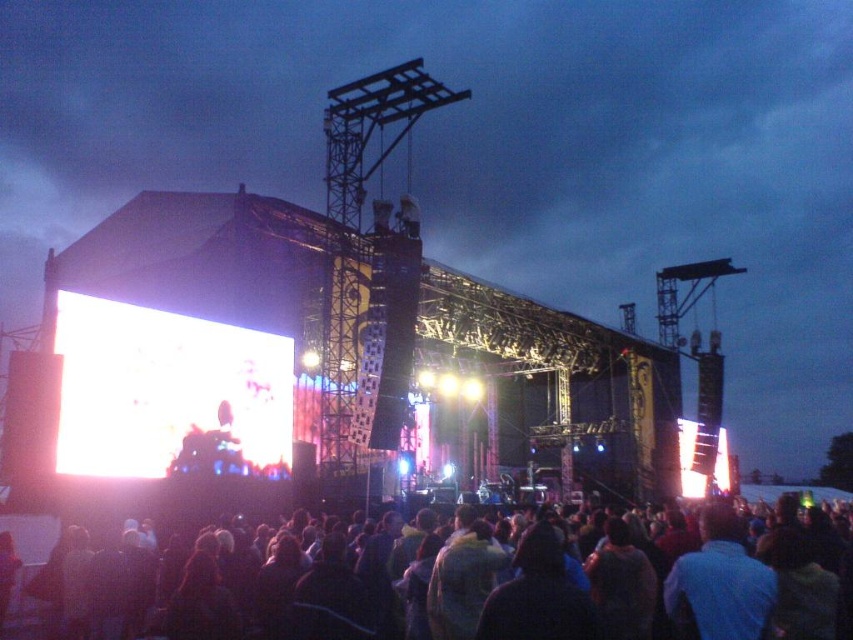
Question: Is the position of dark fabric crowd at lower center more distant than that of bright white screen at center?

Choices:
 (A) no
 (B) yes

Answer: (A)

Question: Which point is farther to the camera?

Choices:
 (A) bright white screen at center
 (B) dark fabric crowd at lower center

Answer: (A)

Question: Can you confirm if dark fabric crowd at lower center is wider than bright white screen at center?

Choices:
 (A) yes
 (B) no

Answer: (A)

Question: Which point is farther from the camera taking this photo?

Choices:
 (A) (148, 312)
 (B) (677, 595)

Answer: (A)

Question: Is dark fabric crowd at lower center positioned at the back of bright white screen at center?

Choices:
 (A) no
 (B) yes

Answer: (A)